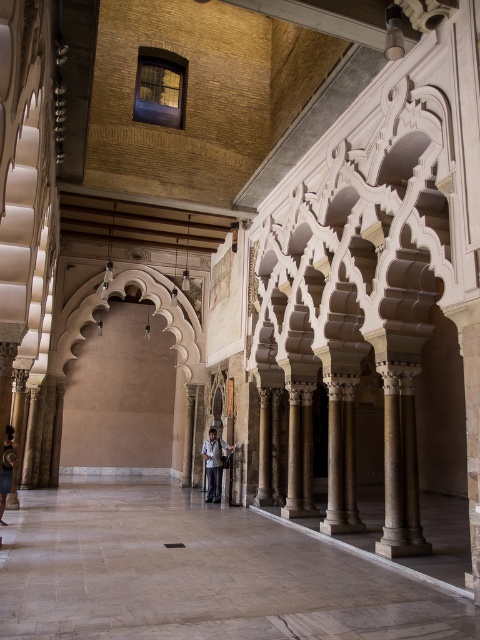
You are standing in the grand architectural space and want to determine which of the two points, point (286, 602) or point (3, 506), is closer to you. Based on the scene description, which point is nearer?

Point (286, 602) is closer to the camera than point (3, 506), so it is nearer to you.

You are standing in the grand architectural space described. You need to walk to the exit located at the end of the brown marble corridor at center. Is the dark gray fabric jacket at center blocking your path?

The brown marble corridor at center is in front of the dark gray fabric jacket at center, meaning the jacket is behind the corridor from your perspective. Therefore, the dark gray fabric jacket at center is not blocking your path to the corridor.

You are standing in the grand architectural space and see the dark gray fabric jacket at center and the dark gray fabric at lower left. Which object is closer to you?

The dark gray fabric jacket at center is closer to you because it is further to the viewer than the dark gray fabric at lower left.